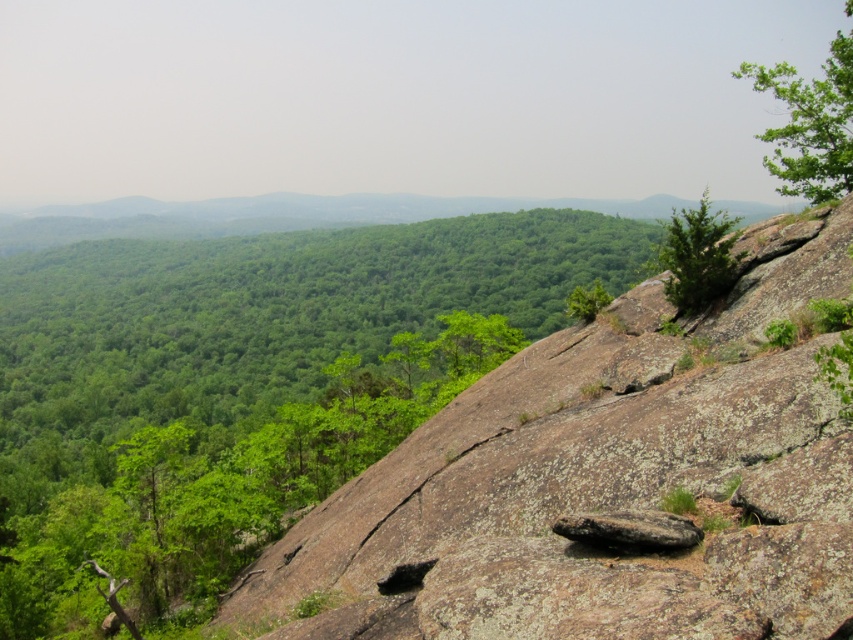
Is point (787, 80) in front of point (683, 211)?

That is False.

At what (x,y) coordinates should I click in order to perform the action: click on green leafy tree at upper right. Please return your answer as a coordinate pair (x, y). Image resolution: width=853 pixels, height=640 pixels. Looking at the image, I should click on (810, 124).

What do you see at coordinates (810, 124) in the screenshot? I see `green leafy tree at upper right` at bounding box center [810, 124].

In order to click on green leafy tree at upper right in this screenshot , I will do `click(810, 124)`.